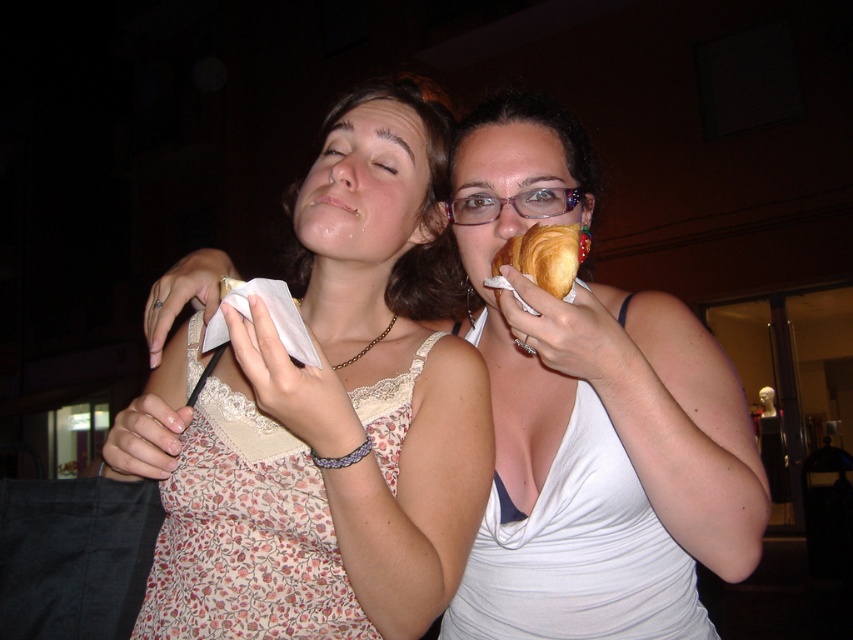
Which is in front, point (595, 636) or point (495, 266)?

Point (495, 266)

Between floral lace tank top at center and golden croissant at upper right, which one is positioned lower?

Positioned lower is floral lace tank top at center.

Between point (743, 432) and point (535, 257), which one is positioned behind?

The point (743, 432) is more distant.

This screenshot has height=640, width=853. Find the location of `floral lace tank top at center`. floral lace tank top at center is located at coordinates (590, 417).